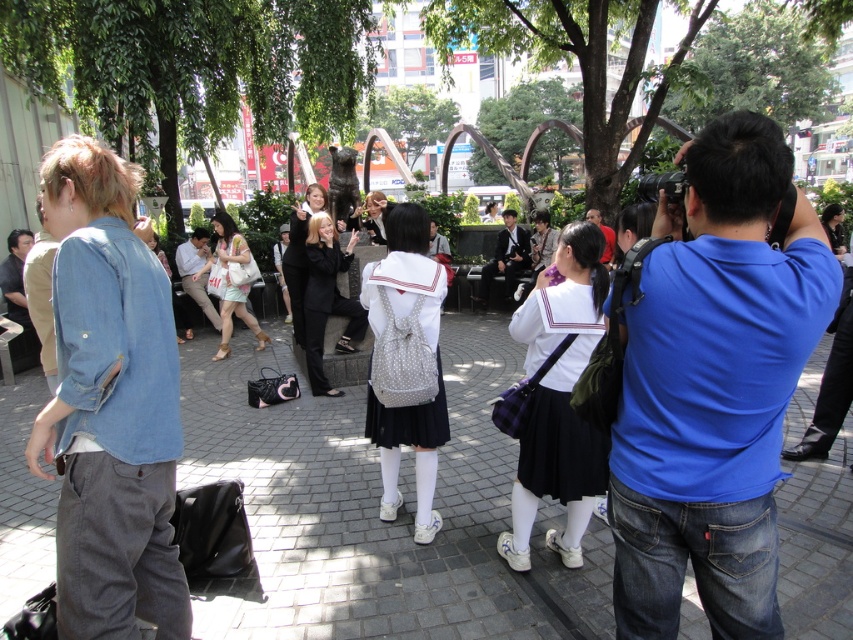
Question: Which point is farther to the camera?

Choices:
 (A) matte black backpack at center
 (B) white fabric backpack at center
 (C) white fabric skirt at center
 (D) denim jacket at left

Answer: (B)

Question: Does blue denim shirt at right have a lesser width compared to light brown leather shoes at center?

Choices:
 (A) no
 (B) yes

Answer: (B)

Question: Is white fabric skirt at center in front of matte black backpack at center?

Choices:
 (A) yes
 (B) no

Answer: (A)

Question: Is white fabric backpack at center positioned in front of matte black backpack at center?

Choices:
 (A) yes
 (B) no

Answer: (B)

Question: Which object appears farthest from the camera in this image?

Choices:
 (A) light pink fabric purse at center
 (B) smooth black hair at center
 (C) matte black suit at center

Answer: (C)

Question: Which point is farther to the camera?

Choices:
 (A) light brown leather shoes at center
 (B) blue denim shirt at right
 (C) white fabric backpack at center
 (D) matte black backpack at center

Answer: (A)